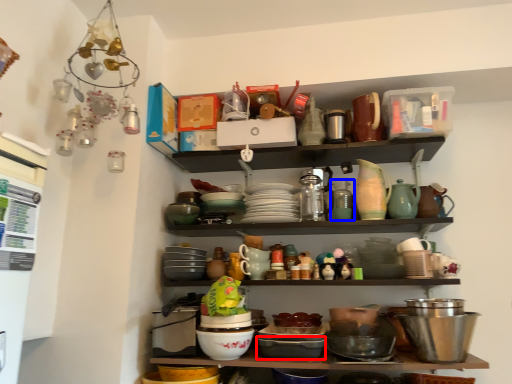
Question: Which object appears closest to the camera in this image, bowl (highlighted by a red box) or tableware (highlighted by a blue box)?

Choices:
 (A) bowl
 (B) tableware

Answer: (A)